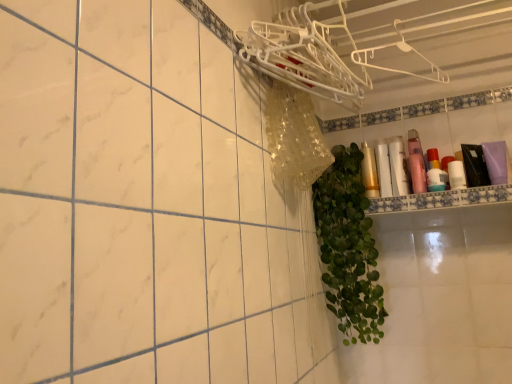
Question: Does white glossy bottle at upper right, which ranks as the 3th toiletry in left-to-right order, have a larger size compared to translucent plastic bottles at upper right, the 1th toiletry in the right-to-left sequence?

Choices:
 (A) no
 (B) yes

Answer: (B)

Question: Is translucent plastic bottles at upper right, positioned as the 5th toiletry in left-to-right order, completely or partially inside white glossy bottle at upper right, acting as the 3th toiletry starting from the right?

Choices:
 (A) yes
 (B) no

Answer: (B)

Question: Does white glossy bottle at upper right, acting as the 3th toiletry starting from the right, lie in front of translucent plastic bottles at upper right, positioned as the 5th toiletry in left-to-right order?

Choices:
 (A) no
 (B) yes

Answer: (B)

Question: Is white glossy bottle at upper right, which ranks as the 3th toiletry in left-to-right order, wider than translucent plastic bottles at upper right, the 1th toiletry in the right-to-left sequence?

Choices:
 (A) yes
 (B) no

Answer: (A)

Question: Does white glossy bottle at upper right, which ranks as the 3th toiletry in left-to-right order, appear on the right side of translucent plastic bottles at upper right, positioned as the 5th toiletry in left-to-right order?

Choices:
 (A) yes
 (B) no

Answer: (B)

Question: Does point (406, 188) appear closer or farther from the camera than point (378, 165)?

Choices:
 (A) farther
 (B) closer

Answer: (B)

Question: From a real-world perspective, is white glossy bottle at upper right, which ranks as the 3th toiletry in left-to-right order, positioned above or below matte gold tube at upper right, which is the 4th toiletry from right to left?

Choices:
 (A) above
 (B) below

Answer: (A)

Question: From the image's perspective, relative to matte gold tube at upper right, which is the 2th toiletry in left-to-right order, is white glossy bottle at upper right, acting as the 3th toiletry starting from the right, above or below?

Choices:
 (A) above
 (B) below

Answer: (A)

Question: Considering their positions, is white glossy bottle at upper right, which ranks as the 3th toiletry in left-to-right order, located in front of or behind matte gold tube at upper right, which is the 4th toiletry from right to left?

Choices:
 (A) front
 (B) behind

Answer: (A)

Question: From the image's perspective, is pink matte bottle at upper right, the 4th toiletry viewed from the left, above or below matte gold tube at upper right, which is the 2th toiletry in left-to-right order?

Choices:
 (A) above
 (B) below

Answer: (A)

Question: Is pink matte bottle at upper right, placed as the 2th toiletry when sorted from right to left, inside the boundaries of matte gold tube at upper right, which is the 4th toiletry from right to left, or outside?

Choices:
 (A) inside
 (B) outside

Answer: (B)

Question: Is pink matte bottle at upper right, placed as the 2th toiletry when sorted from right to left, wider or thinner than matte gold tube at upper right, which is the 4th toiletry from right to left?

Choices:
 (A) thin
 (B) wide

Answer: (B)

Question: Is point 415,175 closer or farther from the camera than point 376,157?

Choices:
 (A) closer
 (B) farther

Answer: (A)

Question: Do you think white glossy shelf at upper right is within gold metallic can at center, which is the first toiletry in left-to-right order, or outside of it?

Choices:
 (A) inside
 (B) outside

Answer: (B)

Question: Relative to gold metallic can at center, which appears as the fifth toiletry when viewed from the right, is white glossy shelf at upper right in front or behind?

Choices:
 (A) behind
 (B) front

Answer: (B)